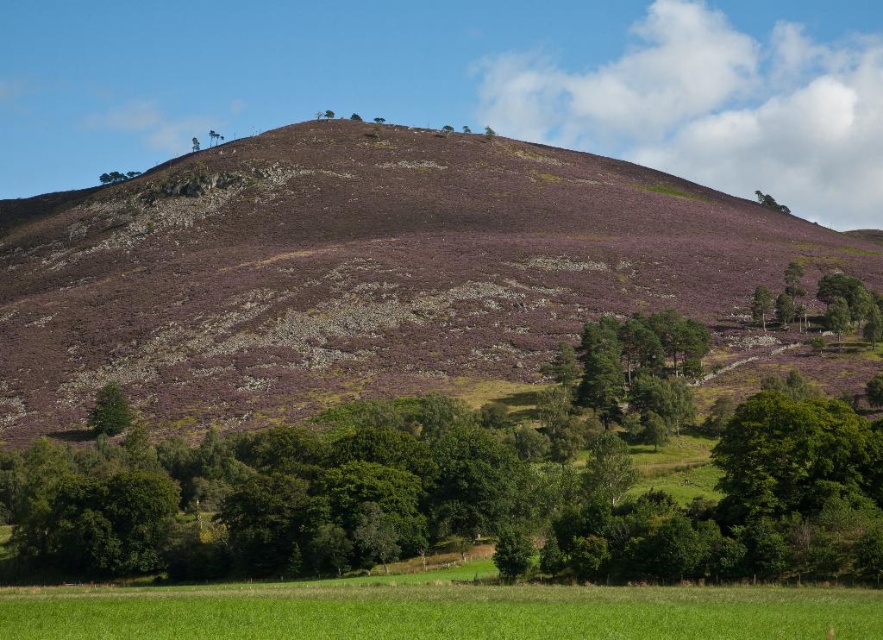
Is green leafy tree at lower right positioned in front of green leafy tree at upper center?

Yes.

Does green leafy tree at lower right have a lesser height compared to green leafy tree at upper center?

Correct, green leafy tree at lower right is not as tall as green leafy tree at upper center.

This screenshot has height=640, width=883. Identify the location of green leafy tree at lower right. (761, 305).

Is purple heather at upper center positioned in front of green leafy tree at upper right?

Yes, it is in front of green leafy tree at upper right.

Can you confirm if purple heather at upper center is thinner than green leafy tree at upper right?

Incorrect, purple heather at upper center's width is not less than green leafy tree at upper right's.

Describe the element at coordinates (358, 269) in the screenshot. The width and height of the screenshot is (883, 640). I see `purple heather at upper center` at that location.

The height and width of the screenshot is (640, 883). What are the coordinates of `purple heather at upper center` in the screenshot? It's located at (358, 269).

Does green leafy tree at upper center appear on the right side of green leafy tree at upper right?

Incorrect, green leafy tree at upper center is not on the right side of green leafy tree at upper right.

Between point (140, 172) and point (770, 202), which one is positioned behind?

The point (140, 172) is behind.

Is point (132, 173) positioned in front of point (768, 202)?

No, (132, 173) is further to viewer.

Find the location of a particular element. The width and height of the screenshot is (883, 640). green leafy tree at upper center is located at coordinates (117, 177).